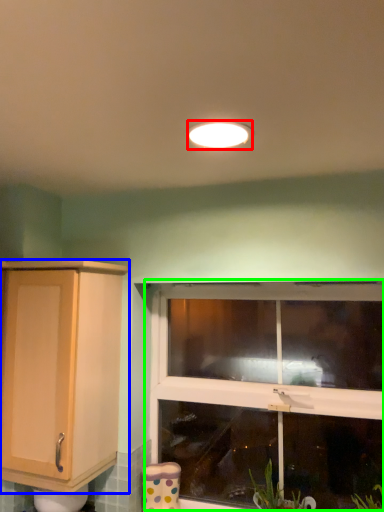
Question: Based on their relative distances, which object is nearer to light fixture (highlighted by a red box)? Choose from cabinetry (highlighted by a blue box) and window (highlighted by a green box).

Choices:
 (A) cabinetry
 (B) window

Answer: (A)